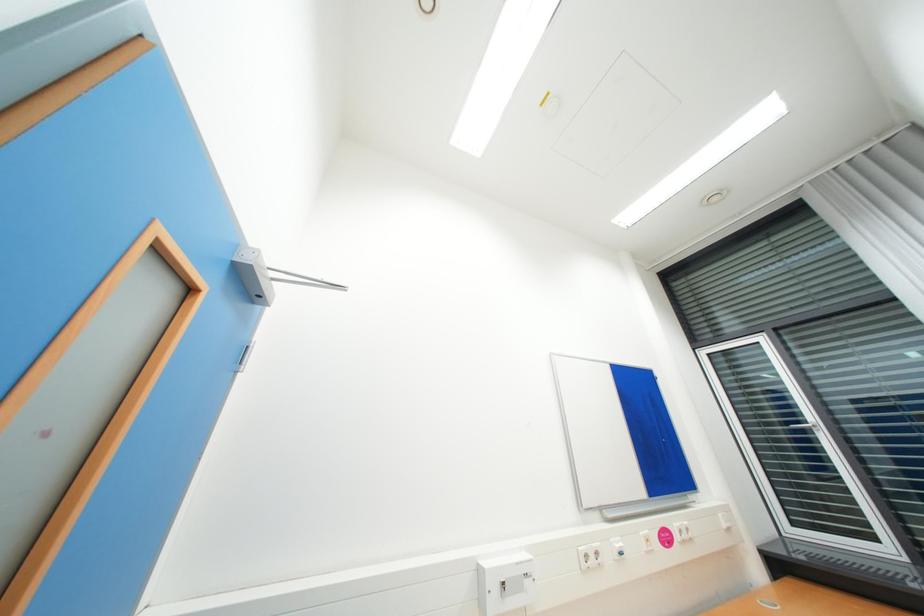
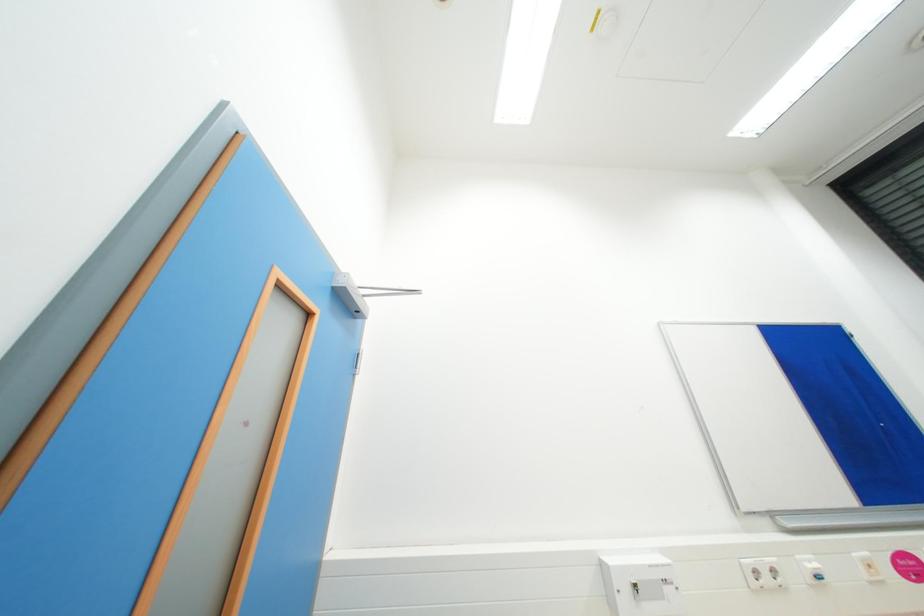
What movement of the cameraman would produce the second image?

The movement direction of the cameraman is right, forward.